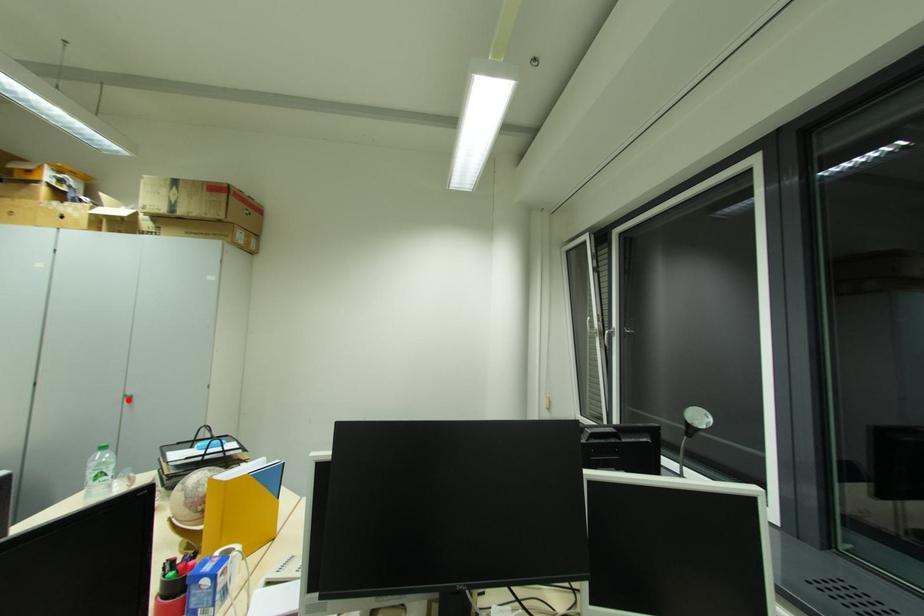
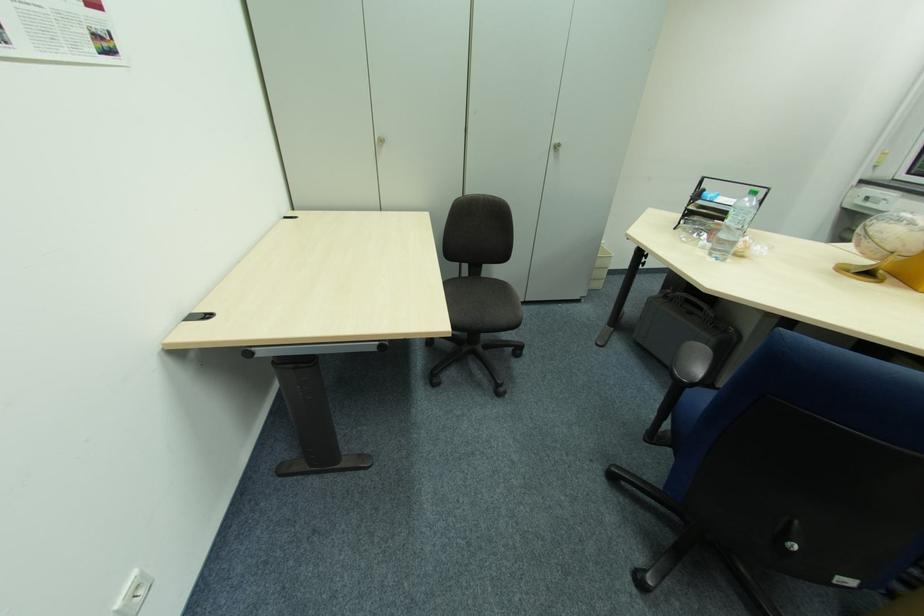
Find the pixel in the second image that matches the highlighted location in the first image.

(554, 150)